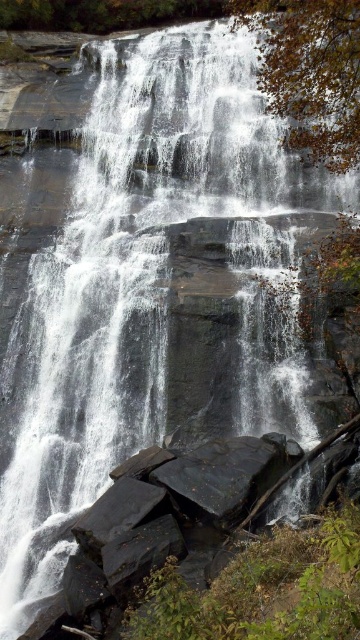
Question: Where is dark gray rock at lower center located in relation to black smooth rock at lower center in the image?

Choices:
 (A) below
 (B) above

Answer: (A)

Question: Which point is closer to the camera taking this photo?

Choices:
 (A) (245, 472)
 (B) (123, 490)
 (C) (141, 572)

Answer: (C)

Question: Does black smooth rock at center have a greater width compared to black smooth rock at lower center?

Choices:
 (A) no
 (B) yes

Answer: (B)

Question: Which is nearer to the dark gray rock at lower center?

Choices:
 (A) black smooth rock at center
 (B) black smooth rock at lower center

Answer: (B)

Question: Which of the following is the closest to the observer?

Choices:
 (A) (90, 518)
 (B) (275, 433)
 (C) (153, 524)

Answer: (C)

Question: Can you confirm if dark gray rock at lower center is positioned below black smooth rock at lower center?

Choices:
 (A) no
 (B) yes

Answer: (B)